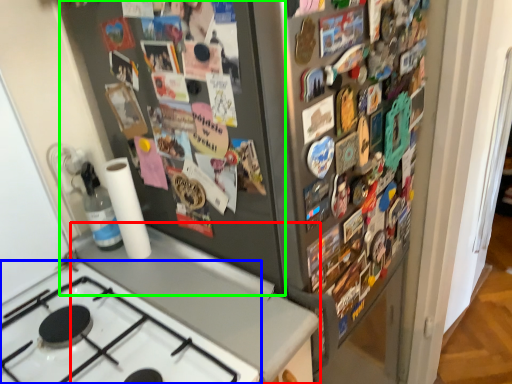
Question: Considering the real-world distances, which object is farthest from counter top (highlighted by a red box)? gas stove (highlighted by a blue box) or bulletin board (highlighted by a green box)?

Choices:
 (A) gas stove
 (B) bulletin board

Answer: (B)